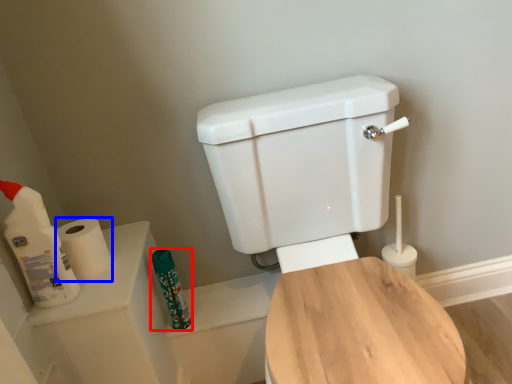
Question: Which point is closer to the camera, toiletry (highlighted by a red box) or toilet paper (highlighted by a blue box)?

Choices:
 (A) toiletry
 (B) toilet paper

Answer: (B)